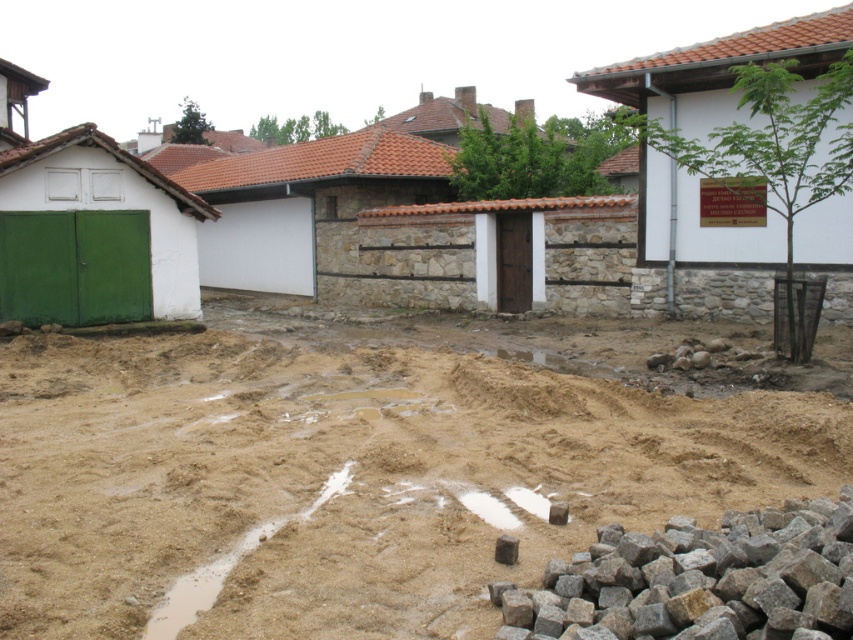
Is the position of gray stone at lower right more distant than that of brown rough stone at lower right?

No, gray stone at lower right is in front of brown rough stone at lower right.

Which is in front, point (569, 618) or point (497, 561)?

Point (569, 618)

Measure the distance between point [573,602] and camera.

They are 3.61 meters apart.

The width and height of the screenshot is (853, 640). I want to click on gray stone at lower right, so click(x=698, y=582).

Is point (91, 492) positioned behind point (769, 595)?

Yes.

Is point (265, 627) less distant than point (700, 586)?

That is False.

Image resolution: width=853 pixels, height=640 pixels. In order to click on brown sandy dirt at center in this screenshot , I will do click(x=358, y=468).

Between brown sandy dirt at center and brown rough stone at lower right, which one appears on the right side from the viewer's perspective?

brown rough stone at lower right

Is point (115, 456) less distant than point (498, 536)?

That is False.

The image size is (853, 640). I want to click on brown sandy dirt at center, so click(358, 468).